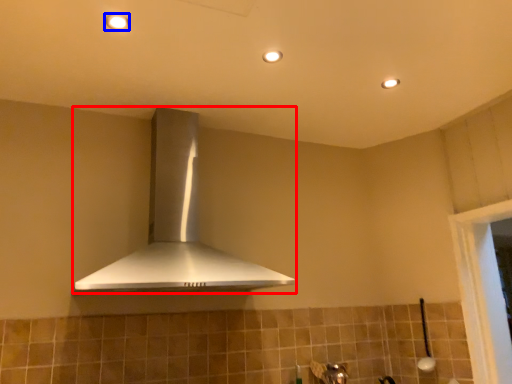
Question: Which point is closer to the camera, home appliance (highlighted by a red box) or light fixture (highlighted by a blue box)?

Choices:
 (A) home appliance
 (B) light fixture

Answer: (A)